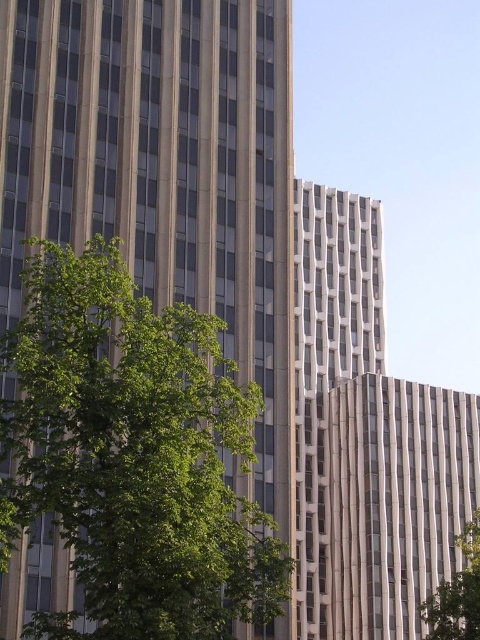
You are an urban planner assessing the space between two green leafy trees. The trees are the green leafy tree at left and the green leafy tree at lower right. Which tree has a wider spread?

The green leafy tree at left has a larger width than the green leafy tree at lower right according to the description.

You are standing in front of the modern buildings and notice two points marked on the image. The first point is at coordinate point (184,380) and the second is at point (460,593). Which point is closer to you?

Point (184,380) is in front of point (460,593), so the first point is closer to you.